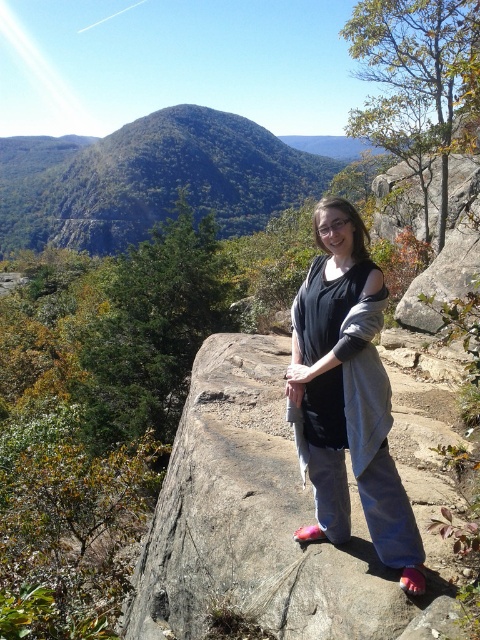
You are a photographer trying to capture the perfect shot of the person in the scene. You notice a point marked at coordinates (280,515). Where is this point located in relation to the rocky outcrop the person is standing on?

The point at (280,515) is located on the gray and rough rock at the center of the rocky outcrop where the person is standing.